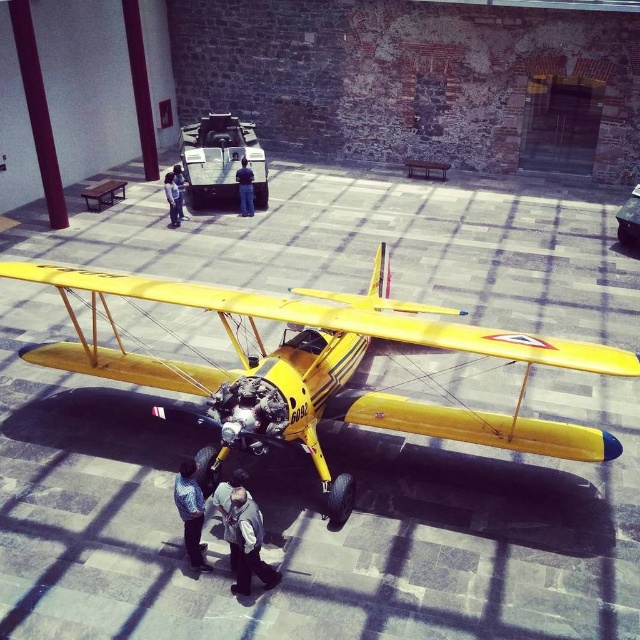
Is gray fabric jacket at lower center to the left of blue denim pants at center from the viewer's perspective?

No, gray fabric jacket at lower center is not to the left of blue denim pants at center.

Identify the location of gray fabric jacket at lower center. Image resolution: width=640 pixels, height=640 pixels. (248, 544).

Find the location of a particular element. The height and width of the screenshot is (640, 640). gray fabric jacket at lower center is located at coordinates (248, 544).

Does yellow matte biplane at center have a greater height compared to gray fabric jacket at lower center?

Indeed, yellow matte biplane at center has a greater height compared to gray fabric jacket at lower center.

Is point (212, 148) positioned in front of point (241, 592)?

No, it is behind (241, 592).

Identify the location of yellow matte biplane at center. (220, 157).

Who is positioned more to the right, patterned fabric shirt at lower center or light blue jeans at center?

Positioned to the right is patterned fabric shirt at lower center.

Measure the distance between point (188, 493) and camera.

Point (188, 493) and camera are 5.83 meters apart.

Locate an element on the screen. Image resolution: width=640 pixels, height=640 pixels. patterned fabric shirt at lower center is located at coordinates (189, 513).

You are a GUI agent. You are given a task and a screenshot of the screen. Output one action in this format:
    pyautogui.click(x=<x>, y=<y>)
    Task: Click on the patterned fabric shirt at lower center
    Image resolution: width=640 pixels, height=640 pixels.
    Given the screenshot: What is the action you would take?
    pyautogui.click(x=189, y=513)